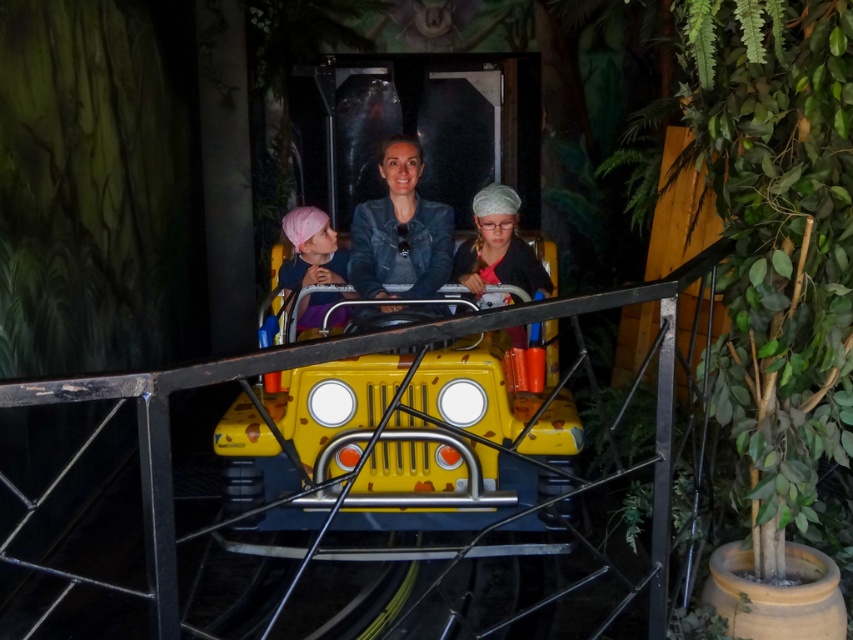
You are a ride attendant checking the safety of the yellow jeep in the jungle scene. You notice two items left behind by a guest near the jeep. The items are the denim jacket at center and the pink fabric headband at left. Which item is bigger in size?

The denim jacket at center has a larger size compared to the pink fabric headband at left, so the denim jacket at center is bigger.

You are a ride operator checking the clearance height for the pink fabric headband at left to pass under the matte black car at center. What can you conclude about the headband passing under the car?

The matte black car at center has a greater height compared to the pink fabric headband at left, so the headband can pass under the car without any issues.

You are a ride operator checking the safety distance between the denim jacket at center and the pink fabric headband at left. The safety guideline requires at least 12 inches between any two items. Is the current distance compliant?

The denim jacket at center is 10.62 inches away from the pink fabric headband at left, which is less than the required 12 inches. Therefore, the current distance does not comply with the safety guideline.